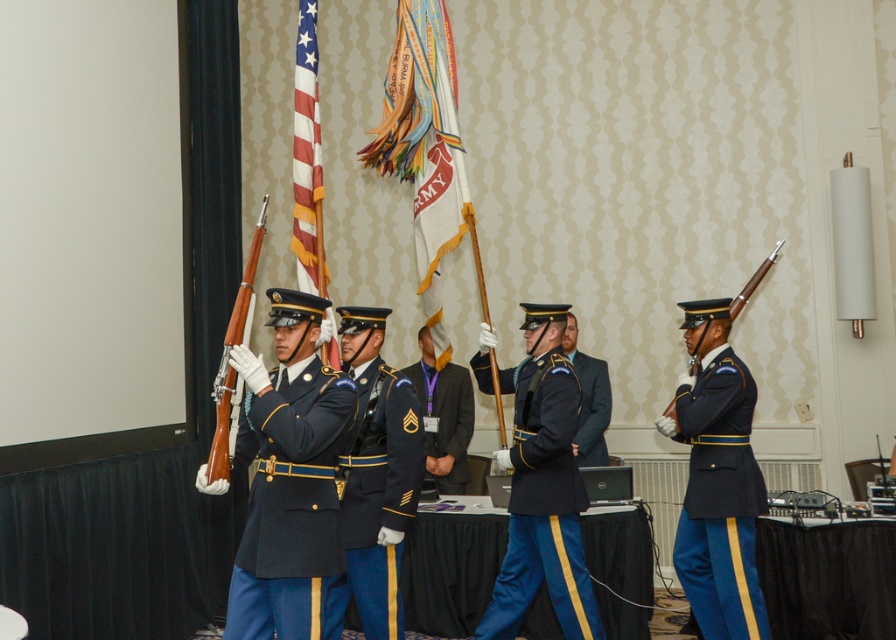
Looking at this image, you are a photographer positioned at point (289, 502). You need to capture a photo of the navy blue fabric uniform at center. Which direction should you move to frame the uniform properly?

The point (289, 502) is already at the center where the navy blue fabric uniform is located, so you don not need to move. You can frame the uniform properly from this position.

You are attending a military ceremony and notice two soldiers in shiny blue uniform at center and shiny dark blue uniform at center. Which soldier is standing in front of the other?

The shiny blue uniform at center is closer to the viewer than the shiny dark blue uniform at center, so the soldier in the shiny blue uniform at center is standing in front.

You are a photographer positioned at the back of the room during the military ceremony. You need to capture a clear photo of both the navy blue fabric uniform at center and the shiny dark blue uniform at center. Given that your camera has a depth of field that can focus on objects within a 10 feet range, will both uniforms be in focus?

The navy blue fabric uniform at center is 9.94 feet away from the shiny dark blue uniform at center. Since the distance between them is within the camera s 10 feet depth of field range, both uniforms will be in focus.